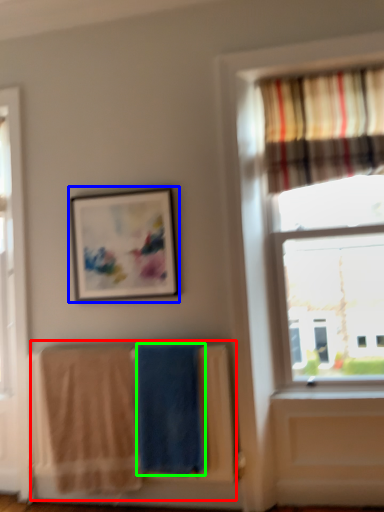
Question: Which object is positioned farthest from laundry (highlighted by a red box)? Select from picture frame (highlighted by a blue box) and beach towel (highlighted by a green box).

Choices:
 (A) picture frame
 (B) beach towel

Answer: (A)